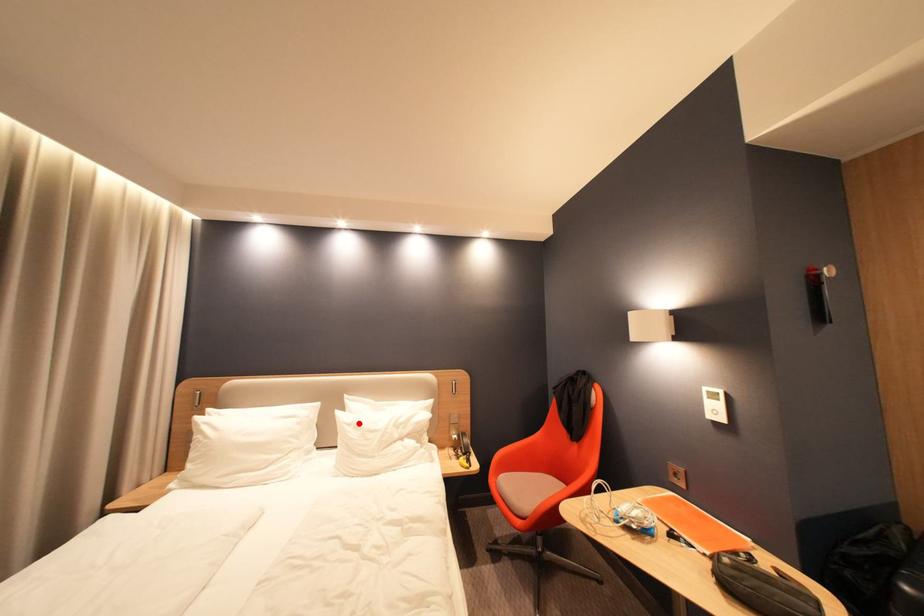
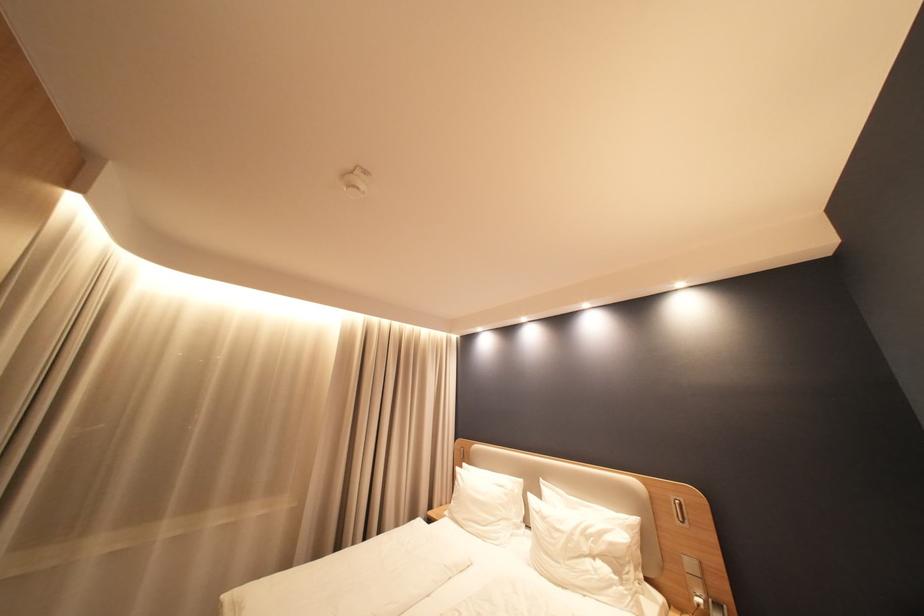
Question: I am providing you with two images of the same scene from different viewpoints. A red point is marked on the first image. At the location where the point appears in image 1, is it still visible in image 2?

Choices:
 (A) Yes
 (B) No

Answer: (A)